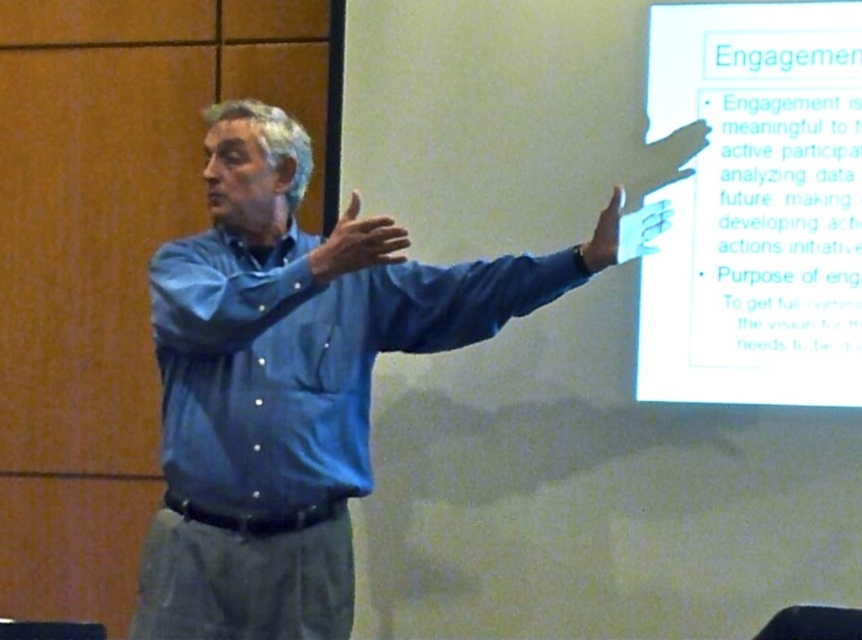
Who is taller, white paper at upper right or matte blue shirt at upper right?

With more height is white paper at upper right.

Can you confirm if white paper at upper right is positioned to the left of matte blue shirt at upper right?

Incorrect, white paper at upper right is not on the left side of matte blue shirt at upper right.

The height and width of the screenshot is (640, 862). What do you see at coordinates (754, 205) in the screenshot? I see `white paper at upper right` at bounding box center [754, 205].

Identify the location of white paper at upper right. (754, 205).

Is blue button-up shirt at center positioned at the back of matte blue shirt at upper right?

That is False.

Find the location of a particular element. The width and height of the screenshot is (862, 640). blue button-up shirt at center is located at coordinates (304, 356).

Does point (703, 22) come closer to viewer compared to point (353, 262)?

No, it is not.

Between white paper at upper right and matte blue shirt at center, which one has less height?

matte blue shirt at center is shorter.

In order to click on white paper at upper right in this screenshot , I will do `click(754, 205)`.

The width and height of the screenshot is (862, 640). Find the location of `white paper at upper right`. white paper at upper right is located at coordinates (754, 205).